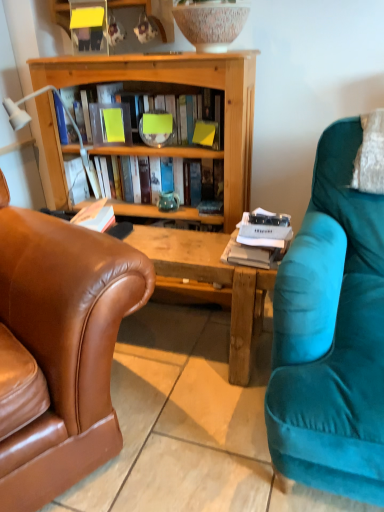
Question: From the image's perspective, would you say yellow paper at center is positioned over teal ceramic vase at center?

Choices:
 (A) yes
 (B) no

Answer: (A)

Question: Is yellow paper at center not inside teal ceramic vase at center?

Choices:
 (A) yes
 (B) no

Answer: (A)

Question: Is teal ceramic vase at center inside yellow paper at center?

Choices:
 (A) no
 (B) yes

Answer: (A)

Question: Considering the relative sizes of yellow paper at center and teal ceramic vase at center in the image provided, is yellow paper at center shorter than teal ceramic vase at center?

Choices:
 (A) no
 (B) yes

Answer: (A)

Question: Does yellow paper at center have a greater height compared to teal ceramic vase at center?

Choices:
 (A) yes
 (B) no

Answer: (A)

Question: Is point (185, 208) closer or farther from the camera than point (168, 201)?

Choices:
 (A) closer
 (B) farther

Answer: (B)

Question: Considering the relative positions of wooden book at center, which is the 1th book from bottom to top, and teal ceramic vase at center in the image provided, is wooden book at center, which is the 1th book from bottom to top, to the left or to the right of teal ceramic vase at center?

Choices:
 (A) right
 (B) left

Answer: (B)

Question: Is wooden book at center, which is the 1th book from bottom to top, wider or thinner than teal ceramic vase at center?

Choices:
 (A) thin
 (B) wide

Answer: (B)

Question: Is wooden book at center, acting as the 2th book starting from the top, taller or shorter than teal ceramic vase at center?

Choices:
 (A) short
 (B) tall

Answer: (B)

Question: Considering the relative positions of yellow paper at center and teal ceramic vase at center in the image provided, is yellow paper at center to the left or to the right of teal ceramic vase at center?

Choices:
 (A) left
 (B) right

Answer: (A)

Question: From the image's perspective, relative to teal ceramic vase at center, is yellow paper at center above or below?

Choices:
 (A) above
 (B) below

Answer: (A)

Question: Is yellow paper at center taller or shorter than teal ceramic vase at center?

Choices:
 (A) short
 (B) tall

Answer: (B)

Question: In terms of size, does yellow paper at center appear bigger or smaller than teal ceramic vase at center?

Choices:
 (A) big
 (B) small

Answer: (A)

Question: Considering the positions of wooden book at center, which is the 1th book from bottom to top, and white plastic lamp at left in the image, is wooden book at center, which is the 1th book from bottom to top, taller or shorter than white plastic lamp at left?

Choices:
 (A) tall
 (B) short

Answer: (B)

Question: Is wooden book at center, acting as the 2th book starting from the top, in front of or behind white plastic lamp at left in the image?

Choices:
 (A) behind
 (B) front

Answer: (A)